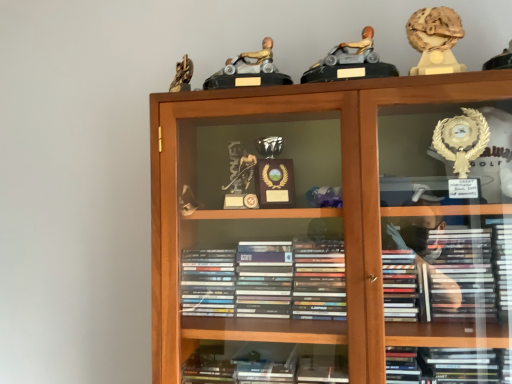
Question: From the image's perspective, is wooden bookcase at center on top of gold marble statue at upper right, which is counted as the 1th toy, starting from the right?

Choices:
 (A) no
 (B) yes

Answer: (A)

Question: Is there a large distance between wooden bookcase at center and gold marble statue at upper right, which is counted as the 1th toy, starting from the right?

Choices:
 (A) no
 (B) yes

Answer: (A)

Question: From a real-world perspective, is wooden bookcase at center located beneath gold marble statue at upper right, which is counted as the 1th toy, starting from the right?

Choices:
 (A) no
 (B) yes

Answer: (B)

Question: Can you confirm if wooden bookcase at center is thinner than gold marble statue at upper right, which is counted as the 1th toy, starting from the right?

Choices:
 (A) no
 (B) yes

Answer: (A)

Question: Would you say wooden bookcase at center is outside gold marble statue at upper right, acting as the 3th toy starting from the left?

Choices:
 (A) no
 (B) yes

Answer: (B)

Question: Would you say matte gray plastic toy car at upper center, the second toy positioned from the right, is to the left or to the right of gold metallic figure at upper center, which is counted as the 1th toy, starting from the left, in the picture?

Choices:
 (A) right
 (B) left

Answer: (A)

Question: Is matte gray plastic toy car at upper center, the second toy in the left-to-right sequence, bigger or smaller than gold metallic figure at upper center, placed as the 3th toy when sorted from right to left?

Choices:
 (A) big
 (B) small

Answer: (B)

Question: Do you think matte gray plastic toy car at upper center, the second toy in the left-to-right sequence, is within gold metallic figure at upper center, which is counted as the 1th toy, starting from the left, or outside of it?

Choices:
 (A) outside
 (B) inside

Answer: (A)

Question: From their relative heights in the image, would you say matte gray plastic toy car at upper center, the second toy positioned from the right, is taller or shorter than gold metallic figure at upper center, placed as the 3th toy when sorted from right to left?

Choices:
 (A) short
 (B) tall

Answer: (B)

Question: From their relative heights in the image, would you say wooden bookcase at center is taller or shorter than gold metallic figure at upper center, which is counted as the 1th toy, starting from the left?

Choices:
 (A) tall
 (B) short

Answer: (A)

Question: Choose the correct answer: Is wooden bookcase at center inside gold metallic figure at upper center, which is counted as the 1th toy, starting from the left, or outside it?

Choices:
 (A) inside
 (B) outside

Answer: (B)

Question: From the image's perspective, is wooden bookcase at center above or below gold metallic figure at upper center, which is counted as the 1th toy, starting from the left?

Choices:
 (A) below
 (B) above

Answer: (A)

Question: Is wooden bookcase at center to the left or to the right of gold metallic figure at upper center, which is counted as the 1th toy, starting from the left, in the image?

Choices:
 (A) right
 (B) left

Answer: (A)

Question: From the image's perspective, is gold metallic figure at upper center, which is counted as the 1th toy, starting from the left, located above or below wooden bookcase at center?

Choices:
 (A) above
 (B) below

Answer: (A)

Question: Is point [266, 59] positioned closer to the camera than point [378, 367]?

Choices:
 (A) closer
 (B) farther

Answer: (B)